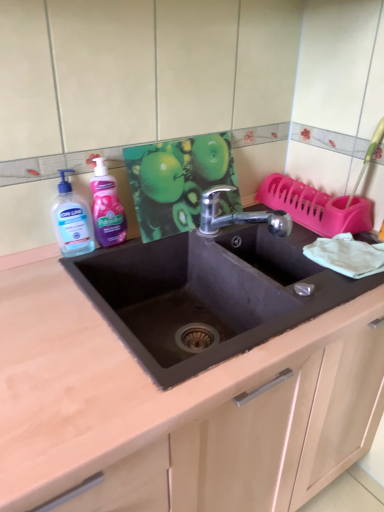
Where is `spots to the right of black matte sink at center`? This screenshot has width=384, height=512. spots to the right of black matte sink at center is located at coordinates (309, 253).